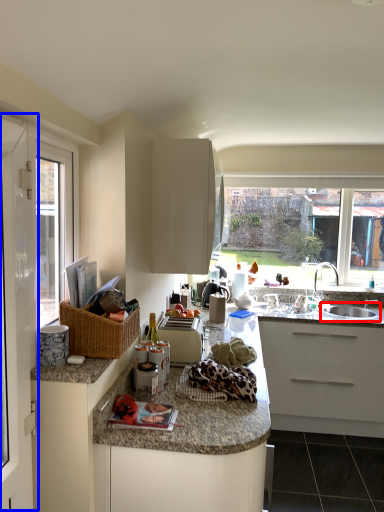
Question: Which object is closer to the camera taking this photo, sink (highlighted by a red box) or screen door (highlighted by a blue box)?

Choices:
 (A) sink
 (B) screen door

Answer: (B)